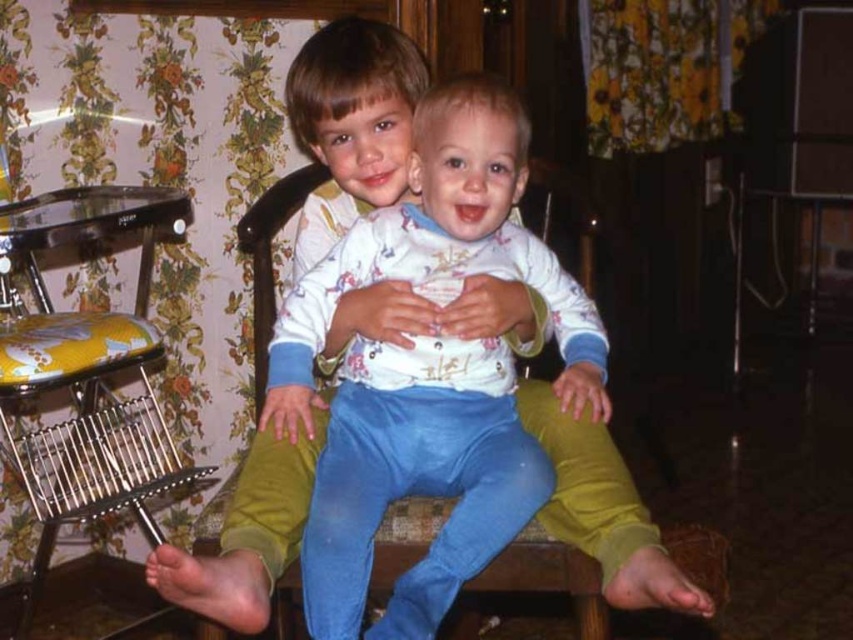
Question: Is white cotton shirt at center positioned in front of yellow fabric rocking chair at left?

Choices:
 (A) no
 (B) yes

Answer: (B)

Question: Does white cotton shirt at center have a smaller size compared to yellow fabric rocking chair at left?

Choices:
 (A) yes
 (B) no

Answer: (A)

Question: Where is white cotton shirt at center located in relation to yellow fabric rocking chair at left in the image?

Choices:
 (A) left
 (B) right

Answer: (B)